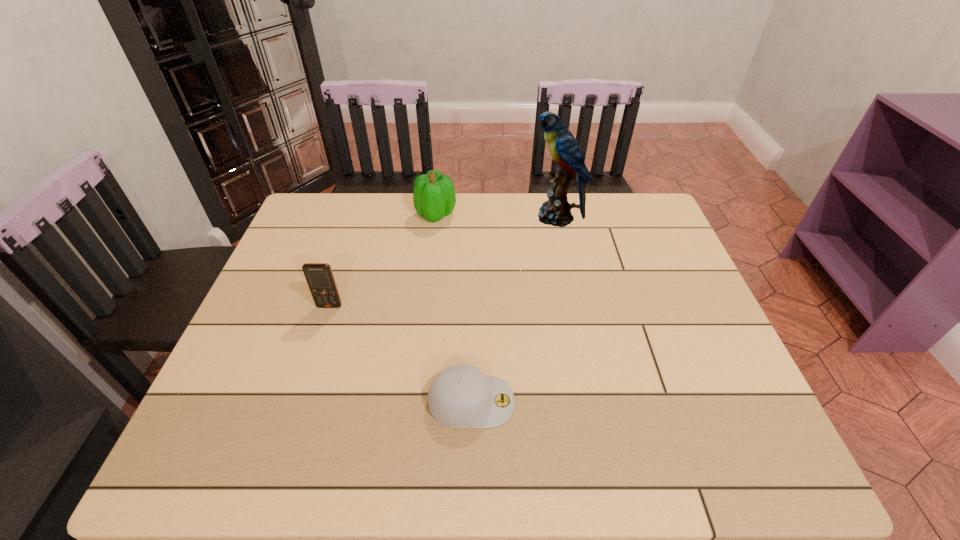
Find the location of `free location at the far left corner`. free location at the far left corner is located at coordinates (339, 208).

At what (x,y) coordinates should I click in order to perform the action: click on blank area at the near left corner. Please return your answer as a coordinate pair (x, y). Looking at the image, I should click on 244,441.

In the image, there is a desktop. Identify the location of free space at the far right corner. (648, 210).

You are a GUI agent. You are given a task and a screenshot of the screen. Output one action in this format:
    pyautogui.click(x=<x>, y=<y>)
    Task: Click on the unoccupied area between the cap and the bell pepper
    The image size is (960, 540).
    Given the screenshot: What is the action you would take?
    pyautogui.click(x=454, y=308)

Identify the location of free space between the rightmost object and the cellular telephone. (443, 261).

Locate an element on the screen. free area in between the nearest object and the tallest object is located at coordinates (514, 309).

Find the location of a particular element. This screenshot has height=540, width=960. free spot between the cap and the cellular telephone is located at coordinates (400, 354).

The image size is (960, 540). What are the coordinates of `unoccupied area between the tallest object and the nearest object` in the screenshot? It's located at (514, 309).

The height and width of the screenshot is (540, 960). Identify the location of free space that is in between the bell pepper and the nearest object. (454, 308).

Where is `free spot between the bell pepper and the parrot`? free spot between the bell pepper and the parrot is located at coordinates (496, 215).